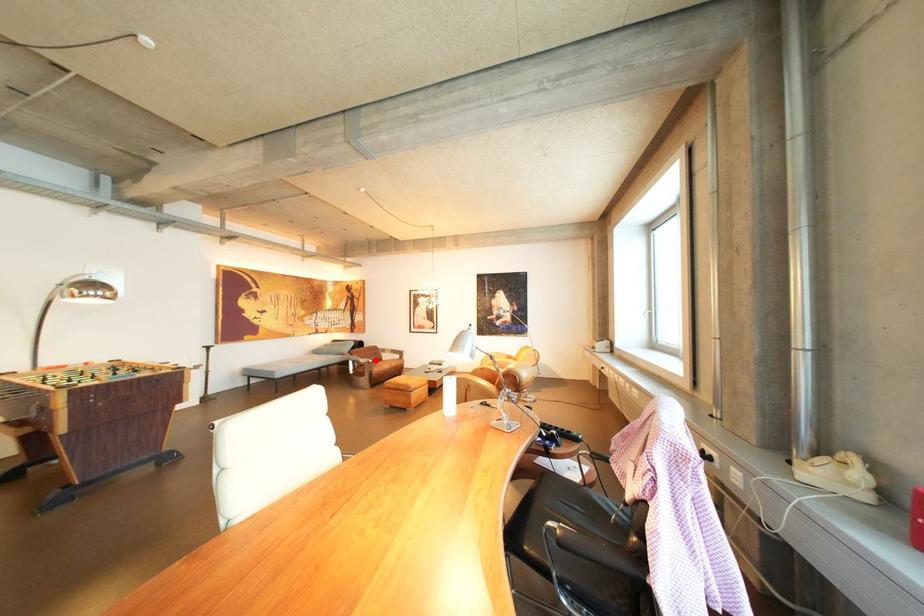
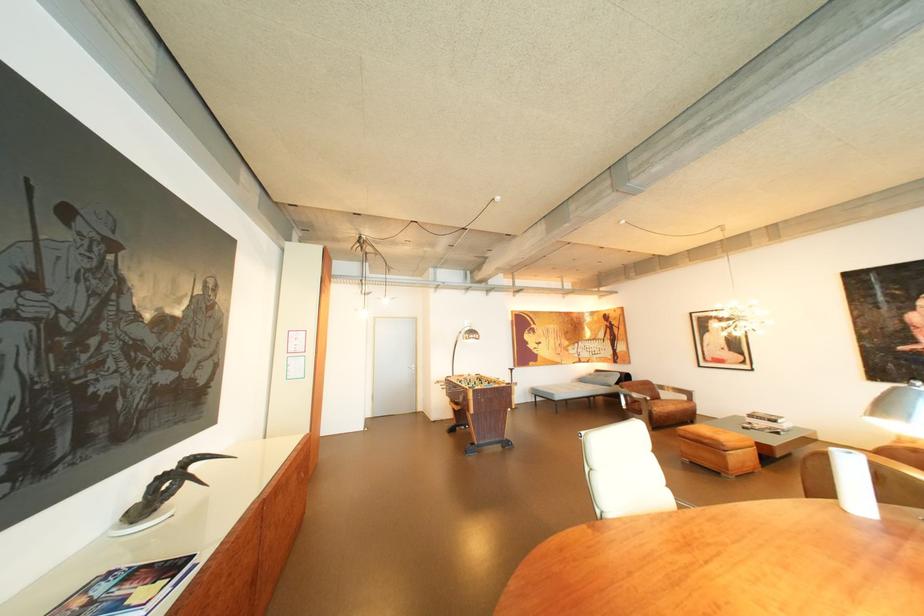
Find the pixel in the second image that matches the highlighted location in the first image.

(649, 395)